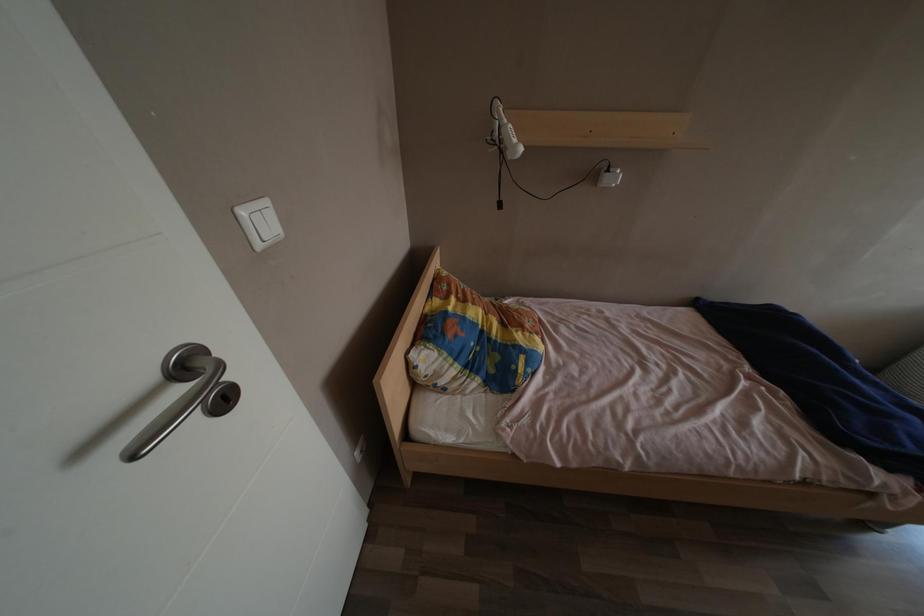
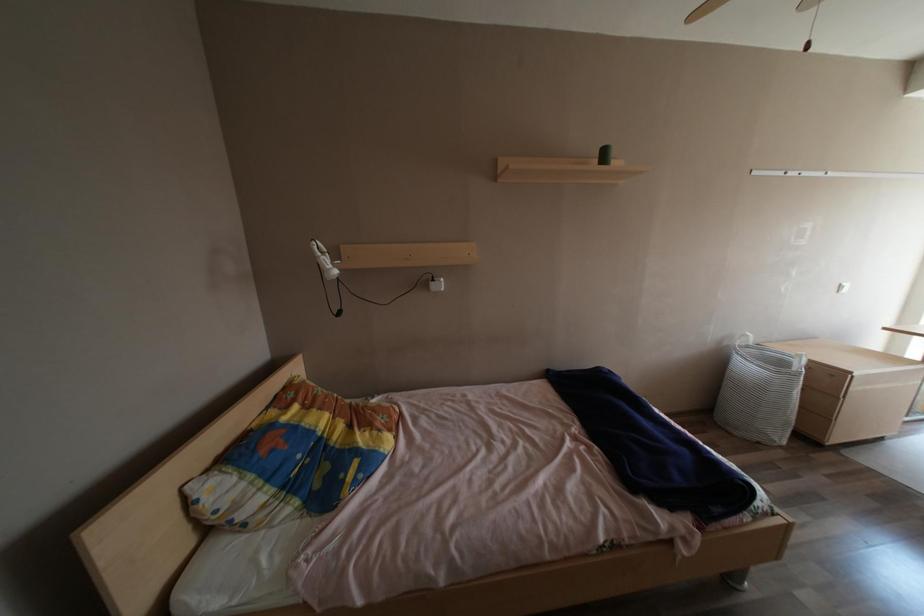
Question: The images are taken continuously from a first-person perspective. In which direction are you moving?

Choices:
 (A) Left
 (B) Right
 (C) Forward
 (D) Backward

Answer: (B)